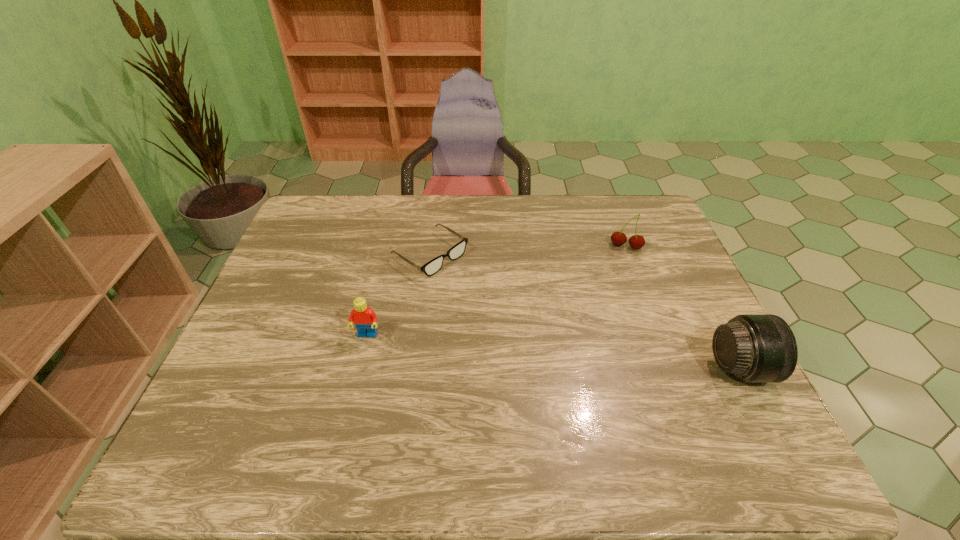
Find the location of `vacant region at the right edge of the desktop`. vacant region at the right edge of the desktop is located at coordinates (707, 364).

Identify the location of vacant space at the far left corner of the desktop. This screenshot has height=540, width=960. (333, 205).

Where is `vacant space at the near left corner of the desktop`? This screenshot has height=540, width=960. vacant space at the near left corner of the desktop is located at coordinates (216, 416).

Where is `vacant space at the far right corner`? The image size is (960, 540). vacant space at the far right corner is located at coordinates (622, 208).

Image resolution: width=960 pixels, height=540 pixels. In order to click on free space at the near right corner in this screenshot , I will do `click(686, 389)`.

Image resolution: width=960 pixels, height=540 pixels. In order to click on empty space between the rightmost object and the cherry in this screenshot , I will do `click(683, 307)`.

The height and width of the screenshot is (540, 960). I want to click on free point between the second object from right to left and the Lego, so click(496, 291).

You are a GUI agent. You are given a task and a screenshot of the screen. Output one action in this format:
    pyautogui.click(x=<x>, y=<y>)
    Task: Click on the vacant area that lies between the Lego and the spectacles
    The image size is (960, 540).
    Given the screenshot: What is the action you would take?
    pyautogui.click(x=398, y=295)

Where is `free space between the third farthest object and the second object from right to left`? This screenshot has height=540, width=960. free space between the third farthest object and the second object from right to left is located at coordinates (496, 291).

Identify the location of empty location between the rightmost object and the second object from right to left. This screenshot has height=540, width=960. (683, 307).